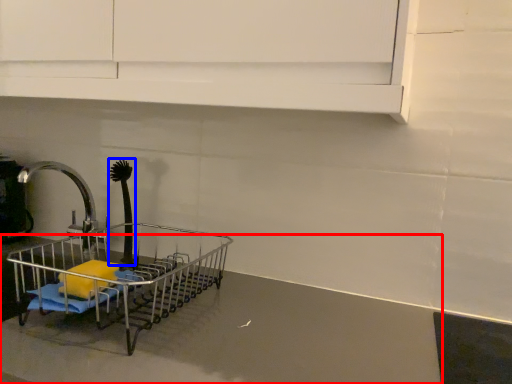
Question: Which object appears farthest to the camera in this image, counter top (highlighted by a red box) or brush (highlighted by a blue box)?

Choices:
 (A) counter top
 (B) brush

Answer: (B)